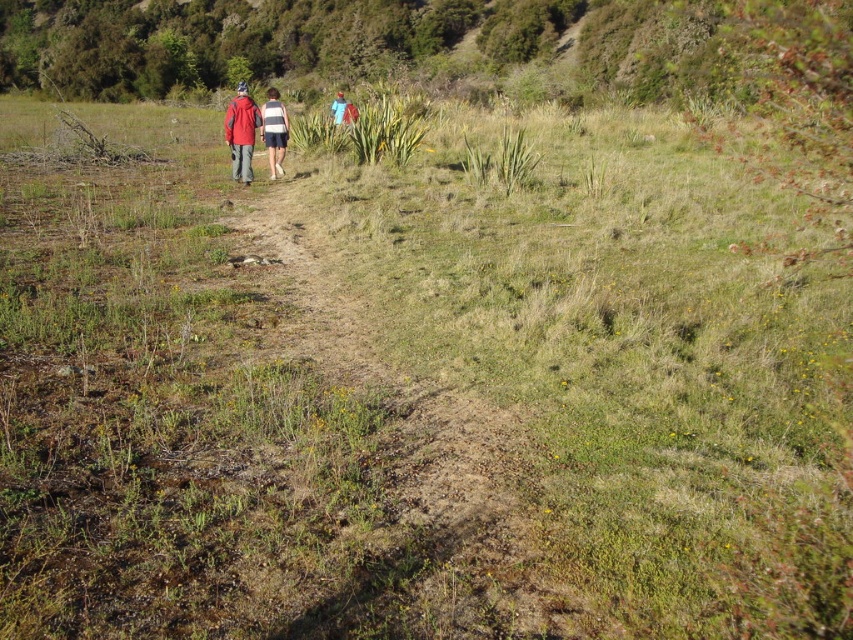
Between point (59, 33) and point (279, 150), which one is positioned in front?

Point (279, 150) is more forward.

Is green grassy hillside at upper center shorter than striped fabric shorts at center?

Incorrect, green grassy hillside at upper center's height does not fall short of striped fabric shorts at center's.

Who is more forward, (80,72) or (268,128)?

Point (268,128) is more forward.

At what (x,y) coordinates should I click in order to perform the action: click on green grassy hillside at upper center. Please return your answer as a coordinate pair (x, y). Looking at the image, I should click on (343, 42).

Is point (312, 22) farther from viewer compared to point (274, 99)?

That is True.

Between green grassy hillside at upper center and red fabric jacket at center, which one has less height?

With less height is red fabric jacket at center.

Is point (474, 17) closer to viewer compared to point (282, 147)?

No, it is not.

This screenshot has height=640, width=853. Identify the location of green grassy hillside at upper center. point(343,42).

Can you confirm if green grassy hillside at upper center is positioned to the right of dried grass at center?

No, green grassy hillside at upper center is not to the right of dried grass at center.

Does green grassy hillside at upper center have a lesser width compared to dried grass at center?

Incorrect, green grassy hillside at upper center's width is not less than dried grass at center's.

Which is in front, point (675, 56) or point (479, 566)?

Positioned in front is point (479, 566).

Image resolution: width=853 pixels, height=640 pixels. In order to click on green grassy hillside at upper center in this screenshot , I will do point(343,42).